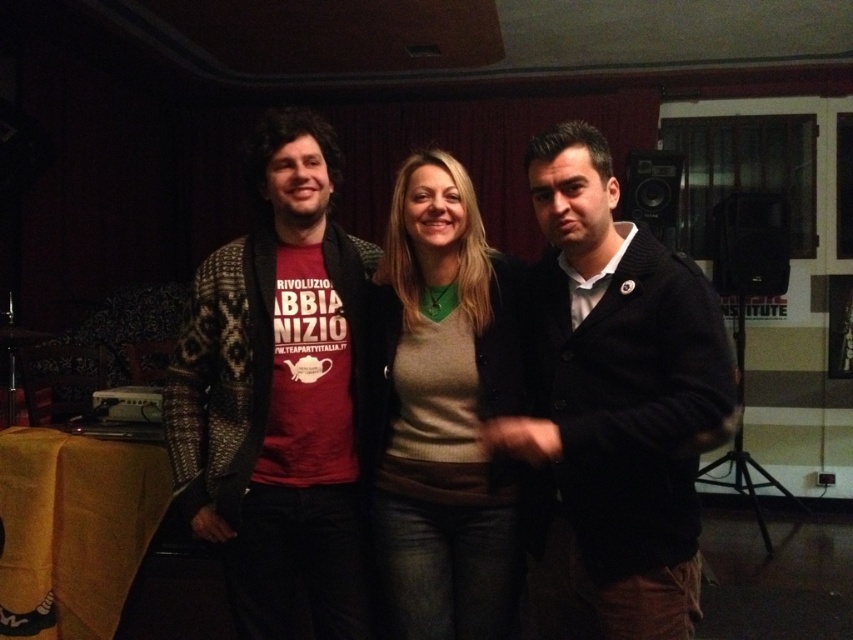
You are organizing a photo shoot and need to arrange two models wearing the dark woolen jacket at center and the matte beige sweater at center. Based on their current positions in the image, which model should you instruct to move to the left to create space for a prop?

The dark woolen jacket at center is to the right of the matte beige sweater at center, so the model wearing the dark woolen jacket at center should move to the left to create space.

You are organizing a clothing donation drive and need to categorize items by size. You have two items at the center of the image, the dark woolen jacket at center and the knitted sweater at center. Which one should you place in the large size bin?

The dark woolen jacket at center has a larger size compared to the knitted sweater at center, so you should place the dark woolen jacket at center in the large size bin.